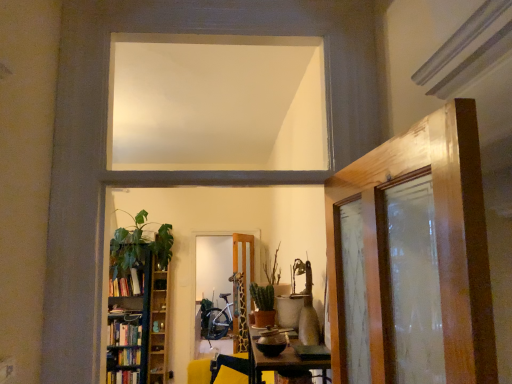
Question: From a real-world perspective, is wooden shelf at left located beneath wooden door at center?

Choices:
 (A) yes
 (B) no

Answer: (A)

Question: Does wooden shelf at left appear on the right side of wooden door at center?

Choices:
 (A) no
 (B) yes

Answer: (A)

Question: Considering the relative sizes of wooden shelf at left and wooden door at center in the image provided, is wooden shelf at left thinner than wooden door at center?

Choices:
 (A) no
 (B) yes

Answer: (B)

Question: Is the depth of wooden shelf at left less than that of wooden door at center?

Choices:
 (A) yes
 (B) no

Answer: (B)

Question: Is wooden shelf at left touching wooden door at center?

Choices:
 (A) no
 (B) yes

Answer: (A)

Question: Is wooden door at center at the back of wooden shelf at left?

Choices:
 (A) yes
 (B) no

Answer: (B)

Question: From the image's perspective, is hardcover books at left located beneath green matte cactus at center, the 2th plant in the back-to-front sequence?

Choices:
 (A) no
 (B) yes

Answer: (B)

Question: From a real-world perspective, does hardcover books at left stand above green matte cactus at center, the 2th plant in the back-to-front sequence?

Choices:
 (A) no
 (B) yes

Answer: (A)

Question: Would you say green matte cactus at center, which is counted as the 1th plant, starting from the front, is part of hardcover books at left's contents?

Choices:
 (A) yes
 (B) no

Answer: (B)

Question: Does hardcover books at left appear on the right side of green matte cactus at center, which is counted as the 1th plant, starting from the front?

Choices:
 (A) yes
 (B) no

Answer: (B)

Question: From the image's perspective, is hardcover books at left on green matte cactus at center, the 2th plant in the back-to-front sequence?

Choices:
 (A) no
 (B) yes

Answer: (A)

Question: Is hardcover books at left further to the viewer compared to green matte cactus at center, the 2th plant in the back-to-front sequence?

Choices:
 (A) no
 (B) yes

Answer: (B)

Question: Considering the relative sizes of yellow fabric swivel chair at center and green matte plant at center, the 2th plant viewed from the front, in the image provided, is yellow fabric swivel chair at center bigger than green matte plant at center, the 2th plant viewed from the front,?

Choices:
 (A) no
 (B) yes

Answer: (B)